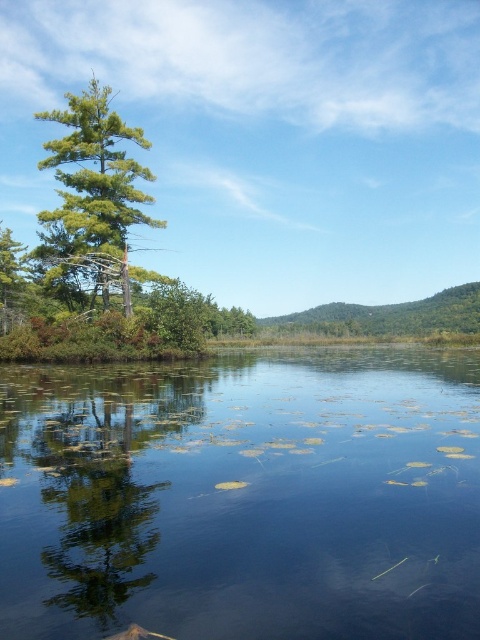
You are an environmental scientist analyzing the image. You need to determine which object occupies more area in the scene between the green leafy water at center and the green leafy tree at center. Based on the description, which one has a bigger size?

The green leafy water at center has a larger size compared to the green leafy tree at center, so the green leafy water at center occupies more area in the scene.

What are the coordinates of the green leafy water at center?

The coordinates of the green leafy water at center are at point (242, 497).

You are standing at the edge of the lake and see two points marked in the image. Which point, point (148, 577) or point (72, 228), is closer to you?

Point (148, 577) is closer to you than point (72, 228).